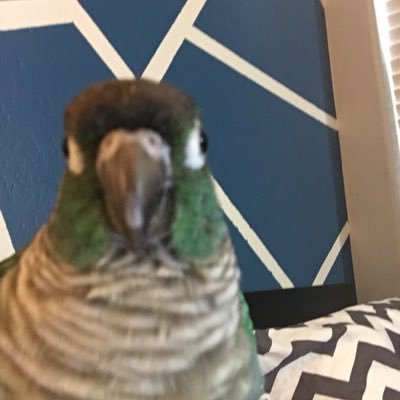
Identify the location of pillow. The width and height of the screenshot is (400, 400). (320, 337).